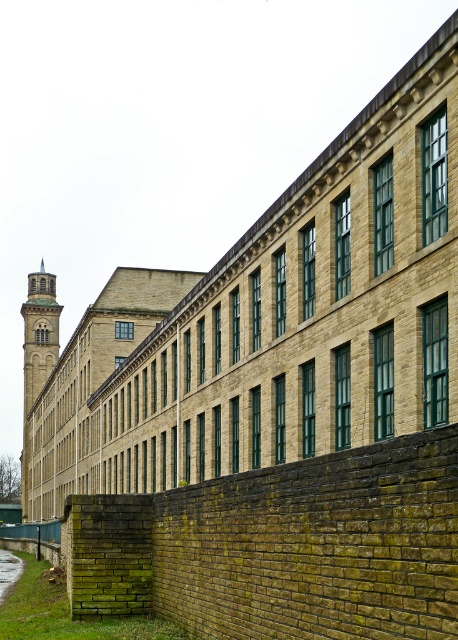
You are standing in front of the historic industrial building and notice the stone clock tower at left and the green grass at lower left. Which object is closer to you from your current viewpoint?

The green grass at lower left is closer to you because the stone clock tower at left is positioned over it, indicating it is further away.

You are standing in front of the historic industrial building and want to take a photo that includes both the stone clock tower at left and the green grass at lower left. Which object should you adjust your camera angle to focus on first to ensure both are in frame?

You should focus on the stone clock tower at left first because it is taller than the green grass at lower left, so adjusting the angle to include its full height will naturally include the shorter grass in the lower part of the frame.

You are standing in front of the historic industrial building and want to take a photo. You notice two points marked on the ground in front of you. The first point is at coordinate point (25, 355), and the second is at point (15, 561). Which point should you stand closer to if you want to be nearer to the building?

You should stand closer to point (15, 561) because it is closer to the building than point (25, 355), which is further away from the building.